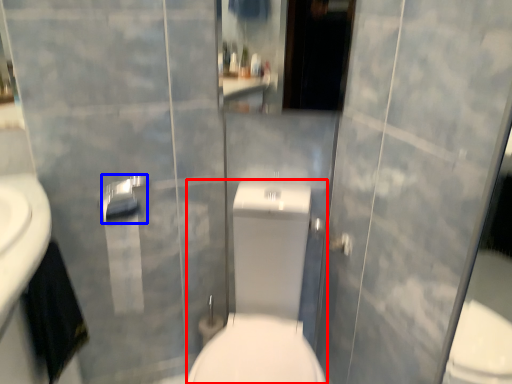
Question: Which of the following is the closest to the observer, sit (highlighted by a red box) or towel bar (highlighted by a blue box)?

Choices:
 (A) sit
 (B) towel bar

Answer: (A)